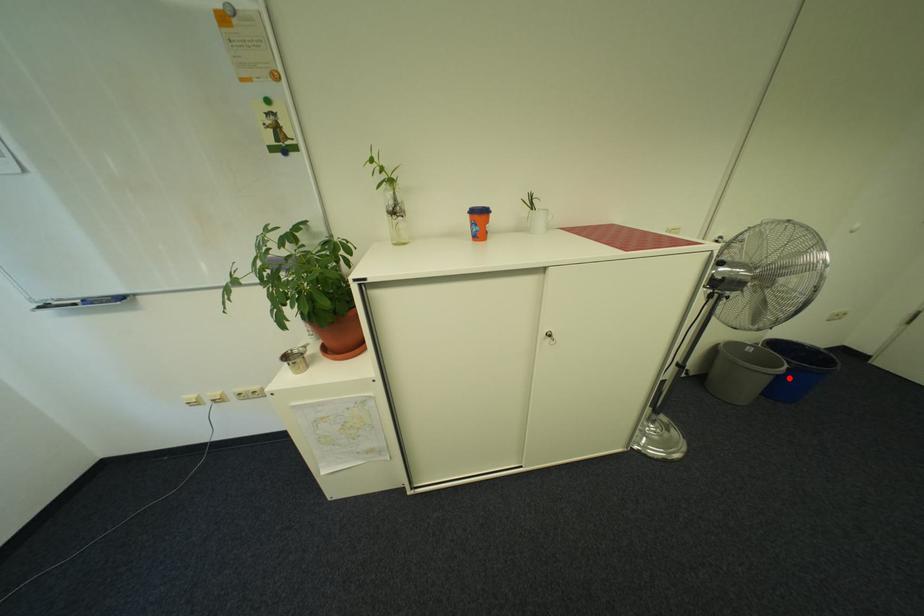
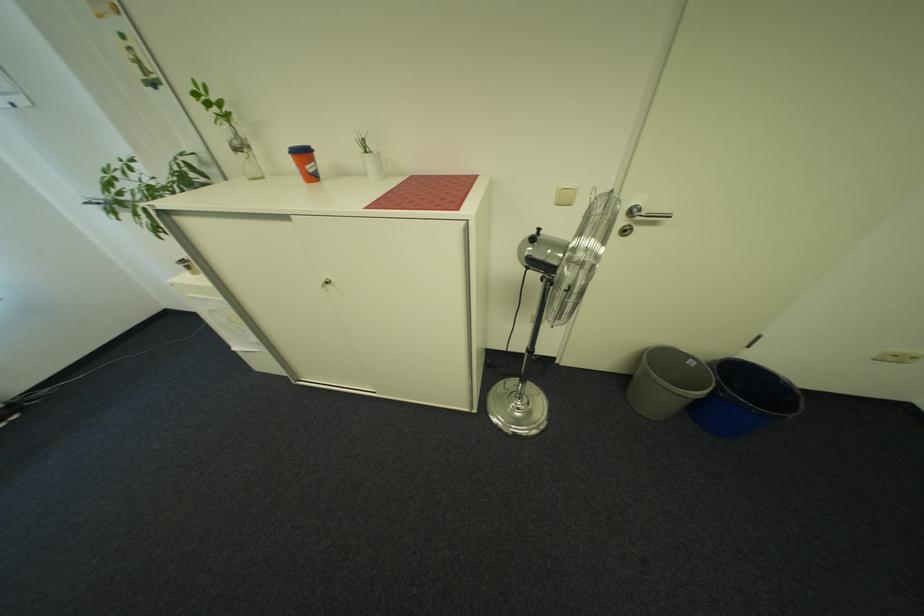
The point at the highlighted location is marked in the first image. Where is the corresponding point in the second image?

(707, 403)